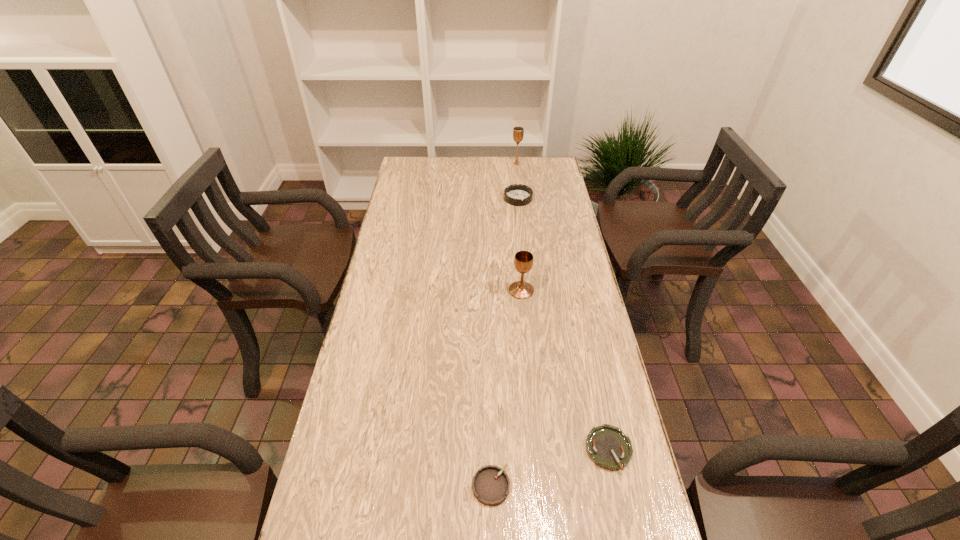
Image resolution: width=960 pixels, height=540 pixels. Identify the location of the third closest object relative to the leftmost ashtray. (517, 194).

Where is `ashtray that stands as the third closest to the fourth shortest object`? ashtray that stands as the third closest to the fourth shortest object is located at coordinates (491, 485).

Where is `the closest ashtray to the rightmost ashtray`? the closest ashtray to the rightmost ashtray is located at coordinates (491, 485).

In order to click on free location that satisfies the following two spatial constraints: 1. on the back side of the rightmost object; 2. on the right side of the leftmost ashtray in this screenshot , I will do `click(491, 449)`.

Locate an element on the screen. vacant region that satisfies the following two spatial constraints: 1. on the back side of the nearer chalice; 2. on the left side of the second ashtray from right to left is located at coordinates pyautogui.click(x=513, y=199).